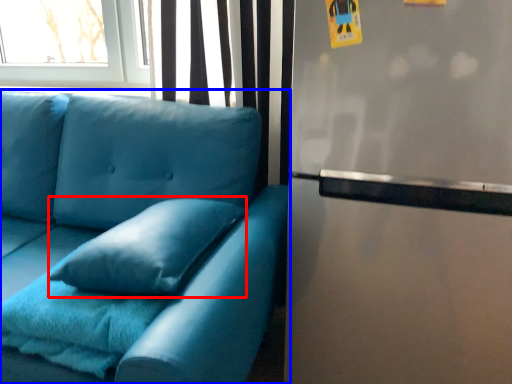
Question: Which object appears farthest to the camera in this image, pillow (highlighted by a red box) or studio couch (highlighted by a blue box)?

Choices:
 (A) pillow
 (B) studio couch

Answer: (A)